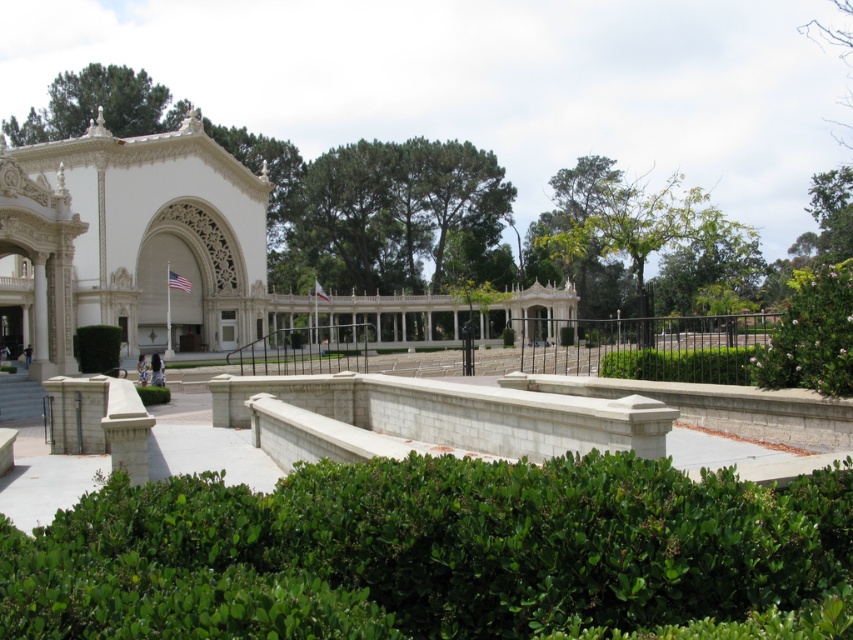
You are standing at the entrance of the grand building and notice two plants in the foreground. Which one, the green leafy hedge at lower center or the green leafy bush at lower center, is positioned closer to the building?

The green leafy hedge at lower center is positioned closer to the building because it is located below the green leafy bush at lower center, meaning it is situated lower in the scene and thus nearer to the structure.

You are a gardener planning to trim the green leafy hedge at lower center and the green leafy tree at upper center. Which of the two plants requires a wider area for trimming due to its size?

The green leafy tree at upper center requires a wider area for trimming because it has a greater width than the green leafy hedge at lower center.

You are standing at the entrance of the grand building and want to reach the point marked as point (252,634). If your walking speed is 3 feet per second, how many seconds will it take you to reach that point?

The distance between you and point (252,634) is 36.38 feet. At a speed of 3 feet per second, it will take approximately 12.13 seconds to reach the point.